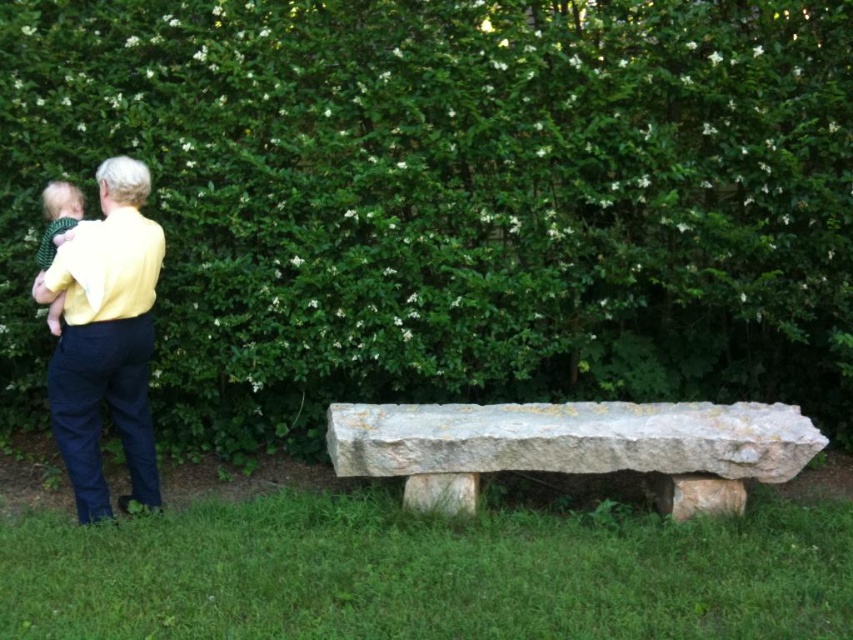
Can you confirm if white stone bench at center is positioned to the left of yellow cotton shirt at left?

In fact, white stone bench at center is to the right of yellow cotton shirt at left.

Can you confirm if white stone bench at center is positioned above yellow cotton shirt at left?

Incorrect, white stone bench at center is not positioned above yellow cotton shirt at left.

This screenshot has width=853, height=640. In order to click on white stone bench at center in this screenshot , I will do `click(573, 448)`.

Is green leafy hedge at upper center taller than white stone bench at center?

Indeed, green leafy hedge at upper center has a greater height compared to white stone bench at center.

Based on the photo, who is lower down, green leafy hedge at upper center or white stone bench at center?

white stone bench at center

Is point (341, 241) positioned after point (432, 483)?

Yes, it is.

Locate an element on the screen. The width and height of the screenshot is (853, 640). green leafy hedge at upper center is located at coordinates (450, 200).

Is green leafy hedge at upper center further to camera compared to yellow cotton shirt at left?

That is True.

Between point (77, 20) and point (45, 291), which one is positioned in front?

Point (45, 291) is in front.

The width and height of the screenshot is (853, 640). What are the coordinates of `green leafy hedge at upper center` in the screenshot? It's located at (450, 200).